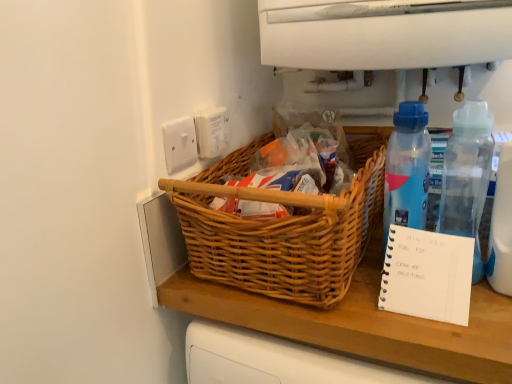
What do you see at coordinates (407, 169) in the screenshot? This screenshot has width=512, height=384. I see `blue translucent bottle at right, placed as the first bottle when sorted from left to right` at bounding box center [407, 169].

What is the approximate width of white spiral notebook at right?

The width of white spiral notebook at right is 10.25 centimeters.

The image size is (512, 384). What do you see at coordinates (283, 227) in the screenshot? I see `woven wood picnic basket at center` at bounding box center [283, 227].

In order to click on white plastic electric outlet at upper center, the second electric outlet from the left in this screenshot , I will do `click(211, 131)`.

Between point (170, 165) and point (417, 161), which one is positioned in front?

The point (417, 161) is closer.

Is white plastic switch at upper left, which ranks as the first electric outlet in left-to-right order, smaller than blue translucent bottle at right, placed as the first bottle when sorted from left to right?

Yes.

Considering the sizes of objects white plastic switch at upper left, which ranks as the first electric outlet in left-to-right order, and blue translucent bottle at right, which is the second bottle from right to left, in the image provided, who is taller, white plastic switch at upper left, which ranks as the first electric outlet in left-to-right order, or blue translucent bottle at right, which is the second bottle from right to left,?

blue translucent bottle at right, which is the second bottle from right to left.

From the image's perspective, between white plastic switch at upper left, which ranks as the first electric outlet in left-to-right order, and blue translucent bottle at right, which is the second bottle from right to left, which one is located above?

From the image's view, white plastic switch at upper left, which ranks as the first electric outlet in left-to-right order, is above.

Is transparent plastic bottle at right, arranged as the second bottle when viewed from the left, spatially inside white plastic switch at upper left, acting as the 2th electric outlet starting from the right, or outside of it?

transparent plastic bottle at right, arranged as the second bottle when viewed from the left, is located beyond the bounds of white plastic switch at upper left, acting as the 2th electric outlet starting from the right.

Considering the positions of points (461, 197) and (177, 126), is point (461, 197) closer to camera compared to point (177, 126)?

No, it is not.

Which object is wider, transparent plastic bottle at right, positioned as the 1th bottle in right-to-left order, or white plastic switch at upper left, acting as the 2th electric outlet starting from the right?

transparent plastic bottle at right, positioned as the 1th bottle in right-to-left order.

Is woven wood picnic basket at center closer to the viewer compared to white plastic electric outlet at upper center, the second electric outlet from the left?

Yes, it is.

Can you confirm if woven wood picnic basket at center is wider than white plastic electric outlet at upper center, the second electric outlet from the left?

Yes, woven wood picnic basket at center is wider than white plastic electric outlet at upper center, the second electric outlet from the left.

From a real-world perspective, is woven wood picnic basket at center positioned over white plastic electric outlet at upper center, marked as the 1th electric outlet in a right-to-left arrangement, based on gravity?

No, from a real-world perspective, woven wood picnic basket at center is not over white plastic electric outlet at upper center, marked as the 1th electric outlet in a right-to-left arrangement

Considering the relative sizes of woven wood picnic basket at center and white plastic electric outlet at upper center, marked as the 1th electric outlet in a right-to-left arrangement, in the image provided, is woven wood picnic basket at center bigger than white plastic electric outlet at upper center, marked as the 1th electric outlet in a right-to-left arrangement,?

Yes.

Can we say white plastic electric outlet at upper center, the second electric outlet from the left, lies outside blue translucent bottle at right, which is the second bottle from right to left?

Yes, white plastic electric outlet at upper center, the second electric outlet from the left, is located beyond the bounds of blue translucent bottle at right, which is the second bottle from right to left.

Does point (224, 135) come in front of point (405, 139)?

No, (224, 135) is behind (405, 139).

From a real-world perspective, does white plastic electric outlet at upper center, the second electric outlet from the left, stand above blue translucent bottle at right, which is the second bottle from right to left?

Indeed, from a real-world perspective, white plastic electric outlet at upper center, the second electric outlet from the left, stands above blue translucent bottle at right, which is the second bottle from right to left.

Looking at this image, is white plastic electric outlet at upper center, marked as the 1th electric outlet in a right-to-left arrangement, in contact with blue translucent bottle at right, which is the second bottle from right to left?

No, white plastic electric outlet at upper center, marked as the 1th electric outlet in a right-to-left arrangement, is not with blue translucent bottle at right, which is the second bottle from right to left.

You are a GUI agent. You are given a task and a screenshot of the screen. Output one action in this format:
    pyautogui.click(x=<x>, y=<y>)
    Task: Click on the bottle lying on the right of blue translucent bottle at right, which is the second bottle from right to left
    
    Given the screenshot: What is the action you would take?
    pyautogui.click(x=467, y=176)

Which object is closer to the camera taking this photo, blue translucent bottle at right, placed as the first bottle when sorted from left to right, or transparent plastic bottle at right, positioned as the 1th bottle in right-to-left order?

transparent plastic bottle at right, positioned as the 1th bottle in right-to-left order.

Considering the positions of point (410, 102) and point (442, 181), is point (410, 102) closer or farther from the camera than point (442, 181)?

Point (410, 102) is positioned closer to the camera compared to point (442, 181).

From the image's perspective, which object appears higher, blue translucent bottle at right, placed as the first bottle when sorted from left to right, or transparent plastic bottle at right, arranged as the second bottle when viewed from the left?

blue translucent bottle at right, placed as the first bottle when sorted from left to right, from the image's perspective.

Which object is wider, woven wood picnic basket at center or blue translucent bottle at right, placed as the first bottle when sorted from left to right?

woven wood picnic basket at center is wider.

Is woven wood picnic basket at center positioned far away from blue translucent bottle at right, placed as the first bottle when sorted from left to right?

woven wood picnic basket at center is near blue translucent bottle at right, placed as the first bottle when sorted from left to right, not far away.

In the scene shown: Considering the positions of objects woven wood picnic basket at center and blue translucent bottle at right, which is the second bottle from right to left, in the image provided, who is behind, woven wood picnic basket at center or blue translucent bottle at right, which is the second bottle from right to left,?

Positioned behind is blue translucent bottle at right, which is the second bottle from right to left.

Which point is more forward, [326,276] or [394,194]?

The point [326,276] is closer.

Does white plastic switch at upper left, acting as the 2th electric outlet starting from the right, appear on the right side of transparent plastic bottle at right, arranged as the second bottle when viewed from the left?

No, white plastic switch at upper left, acting as the 2th electric outlet starting from the right, is not to the right of transparent plastic bottle at right, arranged as the second bottle when viewed from the left.

Can you see white plastic switch at upper left, which ranks as the first electric outlet in left-to-right order, touching transparent plastic bottle at right, arranged as the second bottle when viewed from the left?

white plastic switch at upper left, which ranks as the first electric outlet in left-to-right order, and transparent plastic bottle at right, arranged as the second bottle when viewed from the left, are not in contact.

Which of these two, white plastic switch at upper left, which ranks as the first electric outlet in left-to-right order, or transparent plastic bottle at right, arranged as the second bottle when viewed from the left, stands shorter?

white plastic switch at upper left, which ranks as the first electric outlet in left-to-right order, is shorter.

This screenshot has height=384, width=512. I want to click on the 1st bottle below the white plastic switch at upper left, which ranks as the first electric outlet in left-to-right order (from the image's perspective), so click(x=407, y=169).

The image size is (512, 384). In order to click on the 2nd electric outlet counting from the left of the transparent plastic bottle at right, positioned as the 1th bottle in right-to-left order in this screenshot , I will do `click(179, 144)`.

From the image, which object appears to be farther from white plastic switch at upper left, which ranks as the first electric outlet in left-to-right order, white plastic electric outlet at upper center, marked as the 1th electric outlet in a right-to-left arrangement, or transparent plastic bottle at right, positioned as the 1th bottle in right-to-left order?

transparent plastic bottle at right, positioned as the 1th bottle in right-to-left order, is positioned further to the anchor white plastic switch at upper left, which ranks as the first electric outlet in left-to-right order.

Which object lies nearer to the anchor point woven wood picnic basket at center, white plastic switch at upper left, acting as the 2th electric outlet starting from the right, or blue translucent bottle at right, placed as the first bottle when sorted from left to right?

blue translucent bottle at right, placed as the first bottle when sorted from left to right, is positioned closer to the anchor woven wood picnic basket at center.

Considering their positions, is blue translucent bottle at right, placed as the first bottle when sorted from left to right, positioned further to white plastic switch at upper left, which ranks as the first electric outlet in left-to-right order, than white plastic electric outlet at upper center, the second electric outlet from the left?

blue translucent bottle at right, placed as the first bottle when sorted from left to right, lies further to white plastic switch at upper left, which ranks as the first electric outlet in left-to-right order, than the other object.

Consider the image. Looking at the image, which one is located closer to white plastic switch at upper left, acting as the 2th electric outlet starting from the right, transparent plastic bottle at right, positioned as the 1th bottle in right-to-left order, or woven wood picnic basket at center?

The object closer to white plastic switch at upper left, acting as the 2th electric outlet starting from the right, is woven wood picnic basket at center.

Looking at the image, which one is located closer to transparent plastic bottle at right, positioned as the 1th bottle in right-to-left order, white spiral notebook at right or blue translucent bottle at right, placed as the first bottle when sorted from left to right?

blue translucent bottle at right, placed as the first bottle when sorted from left to right.

When comparing their distances from white plastic electric outlet at upper center, the second electric outlet from the left, does white spiral notebook at right or woven wood picnic basket at center seem closer?

woven wood picnic basket at center.

Estimate the real-world distances between objects in this image. Which object is further from white spiral notebook at right, blue translucent bottle at right, which is the second bottle from right to left, or woven wood picnic basket at center?

woven wood picnic basket at center.

When comparing their distances from white spiral notebook at right, does transparent plastic bottle at right, arranged as the second bottle when viewed from the left, or white plastic switch at upper left, which ranks as the first electric outlet in left-to-right order, seem closer?

Result: transparent plastic bottle at right, arranged as the second bottle when viewed from the left, lies closer to white spiral notebook at right than the other object.

Locate an element on the screen. This screenshot has height=384, width=512. notebook between woven wood picnic basket at center and transparent plastic bottle at right, positioned as the 1th bottle in right-to-left order, from left to right is located at coordinates (426, 275).

This screenshot has height=384, width=512. What are the coordinates of `picnic basket between white plastic switch at upper left, acting as the 2th electric outlet starting from the right, and transparent plastic bottle at right, arranged as the second bottle when viewed from the left, from left to right` in the screenshot? It's located at (283, 227).

Image resolution: width=512 pixels, height=384 pixels. I want to click on picnic basket between white plastic switch at upper left, which ranks as the first electric outlet in left-to-right order, and blue translucent bottle at right, placed as the first bottle when sorted from left to right, from left to right, so click(x=283, y=227).

Identify the location of bottle between white plastic electric outlet at upper center, marked as the 1th electric outlet in a right-to-left arrangement, and white spiral notebook at right. The height and width of the screenshot is (384, 512). (407, 169).